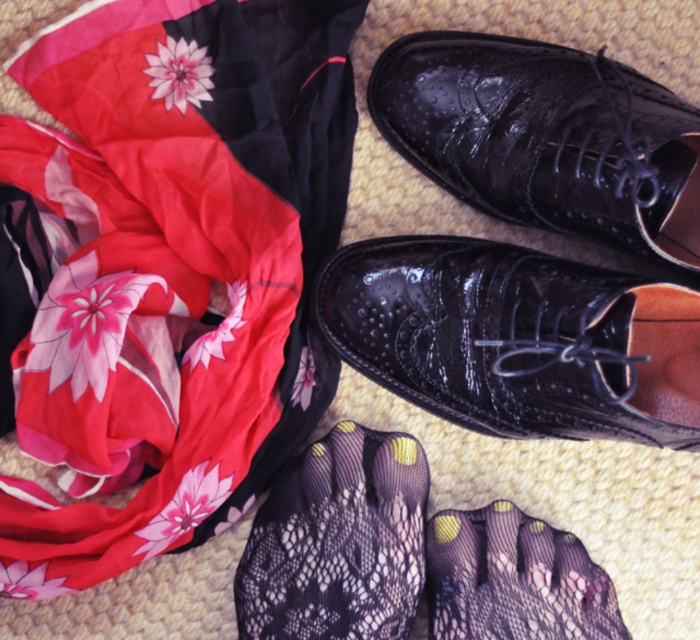
Which is above, glossy leather shoe at center or black lace foot at lower right?

glossy leather shoe at center is higher up.

Is glossy leather shoe at center positioned in front of black lace foot at lower right?

Yes, it is.

Locate an element on the screen. Image resolution: width=700 pixels, height=640 pixels. glossy leather shoe at center is located at coordinates (517, 339).

Can you confirm if floral silk scarf at upper left is shorter than glossy patent leather shoe at center?

No, floral silk scarf at upper left is not shorter than glossy patent leather shoe at center.

What do you see at coordinates (164, 269) in the screenshot?
I see `floral silk scarf at upper left` at bounding box center [164, 269].

Locate an element on the screen. The height and width of the screenshot is (640, 700). floral silk scarf at upper left is located at coordinates (164, 269).

Does black lace foot at lower right come behind black mesh sock at lower center?

That is False.

Between black lace foot at lower right and black mesh sock at lower center, which one has less height?

With less height is black mesh sock at lower center.

Which is behind, point (302, 612) or point (560, 595)?

Positioned behind is point (560, 595).

This screenshot has height=640, width=700. In order to click on black lace foot at lower right in this screenshot , I will do `click(337, 541)`.